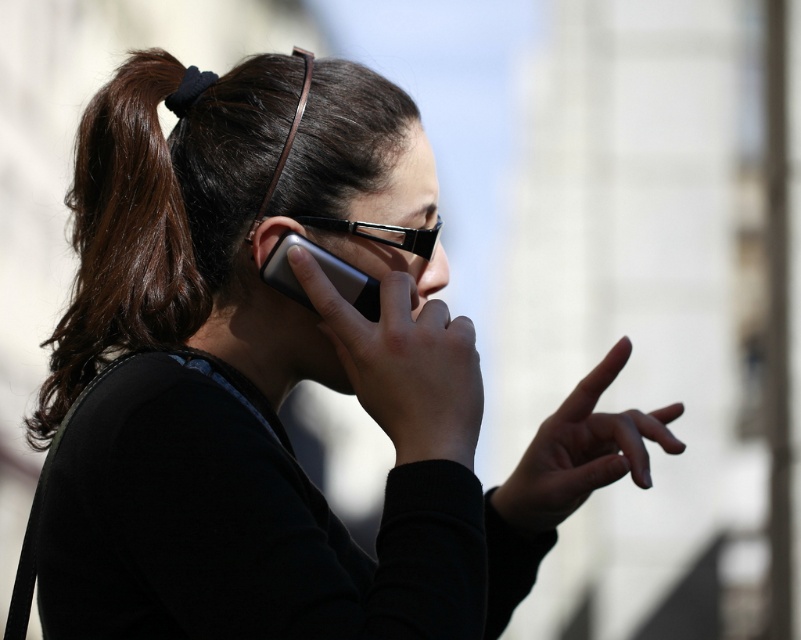
You are a photographer adjusting the focus on your camera. You notice two objects in the scene that need to be in focus simultaneously. The objects are the black plastic glasses at center and the matte black ear at center. Based on their positions, can both be in focus at the same time?

The black plastic glasses at center is located above the matte black ear at center. Since they are positioned close to each other vertically, they can likely be in focus simultaneously if the camera is focused appropriately.

Based on the photo, you are a photographer trying to capture a candid shot of the woman talking on the phone. The matte black phone at center and the matte black ear at center are both important elements in your frame. Given their distance apart, do you think you can fit both into your camera viewfinder without moving your position?

The distance between the matte black phone at center and the matte black ear at center is 3.46 meters. Since the phone and ear are positioned far apart, it might be challenging to fit both into the camera viewfinder without adjusting your position or zoom level.